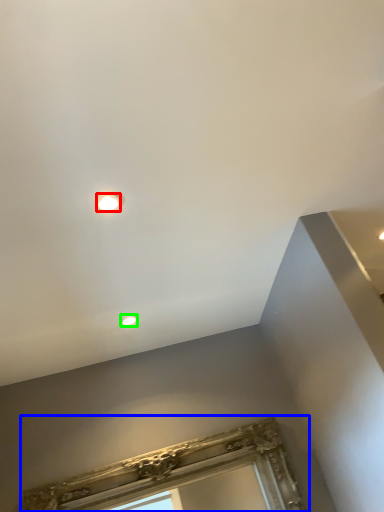
Question: Estimate the real-world distances between objects in this image. Which object is farther from droplight (highlighted by a red box), window frame (highlighted by a blue box) or droplight (highlighted by a green box)?

Choices:
 (A) window frame
 (B) droplight

Answer: (A)